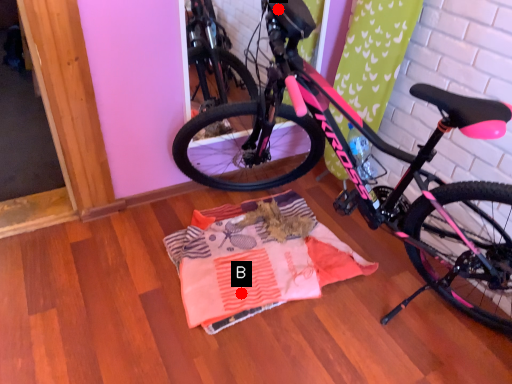
Question: Two points are circled on the image, labeled by A and B beside each circle. Among these points, which one is farthest from the camera?

Choices:
 (A) A is further
 (B) B is further

Answer: (B)